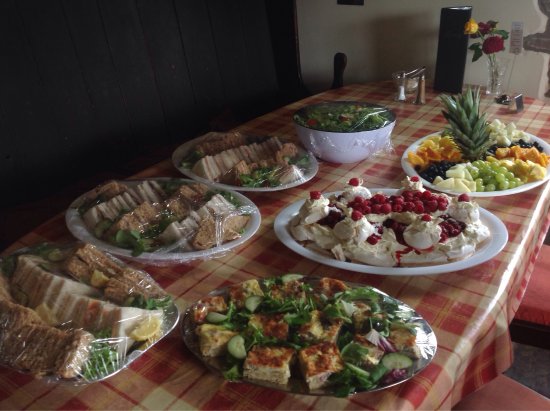
I want to click on white wall, so click(x=357, y=34), click(x=513, y=11).